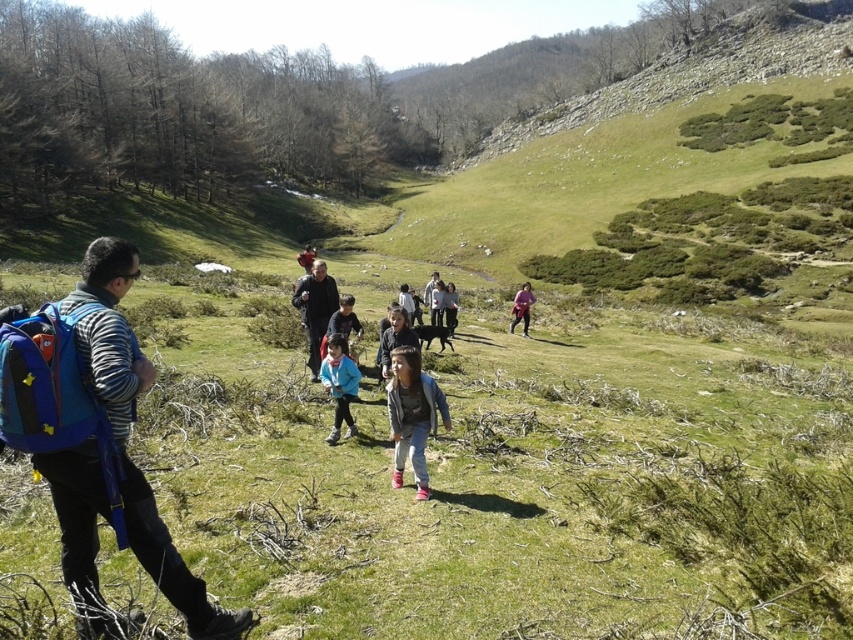
Does light blue fabric jacket at center appear on the right side of pink fabric at center?

Incorrect, light blue fabric jacket at center is not on the right side of pink fabric at center.

Who is more forward, (337, 321) or (527, 307)?

Point (337, 321) is in front.

Does point (355, 316) come behind point (514, 314)?

No, it is not.

Where is `light blue fabric jacket at center`? The image size is (853, 640). light blue fabric jacket at center is located at coordinates (341, 323).

Who is taller, light brown hair at center or pink fabric at center?

With more height is pink fabric at center.

From the picture: Between light brown hair at center and pink fabric at center, which one has less height?

light brown hair at center

Which is behind, point (387, 355) or point (520, 298)?

Point (520, 298)

Identify the location of light brown hair at center. (393, 339).

Is the position of blue fabric backpack at left less distant than that of light gray sweater at center?

Yes, blue fabric backpack at left is closer to the viewer.

Does blue fabric backpack at left have a smaller size compared to light gray sweater at center?

Indeed, blue fabric backpack at left has a smaller size compared to light gray sweater at center.

Describe the element at coordinates (96, 436) in the screenshot. I see `blue fabric backpack at left` at that location.

This screenshot has width=853, height=640. What are the coordinates of `blue fabric backpack at left` in the screenshot? It's located at (96, 436).